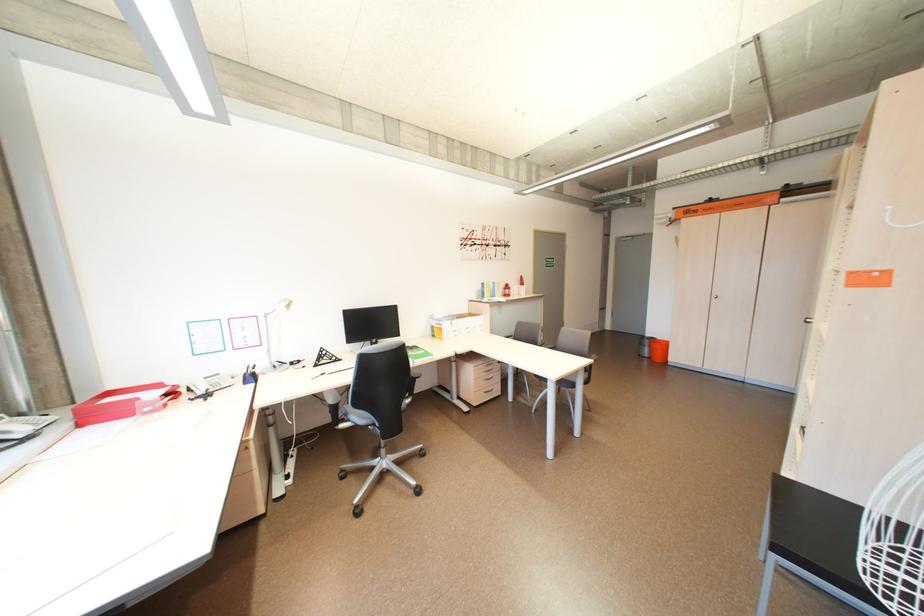
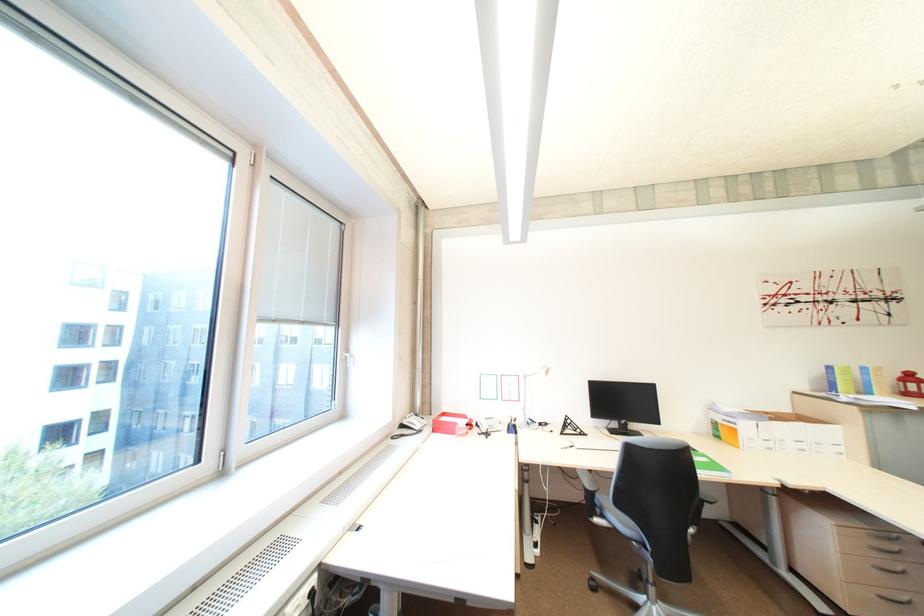
Find the pixel in the second image that matches point (514, 290) in the first image.

(913, 382)